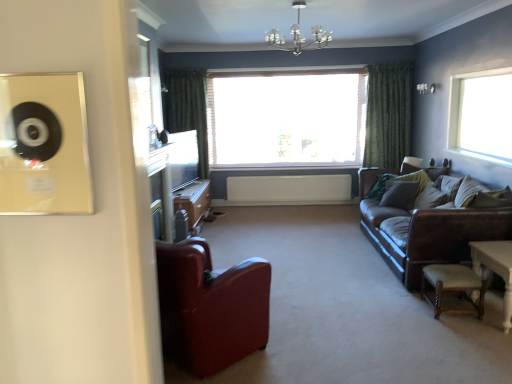
You are a GUI agent. You are given a task and a screenshot of the screen. Output one action in this format:
    pyautogui.click(x=<x>, y=<y>)
    Task: Click on the green velvet curtain at left, acting as the second curtain starting from the right
    
    Given the screenshot: What is the action you would take?
    pyautogui.click(x=187, y=108)

The width and height of the screenshot is (512, 384). Describe the element at coordinates (496, 269) in the screenshot. I see `white wooden table at lower right` at that location.

Measure the distance between point (241,340) and camera.

2.65 meters.

In order to face leather armchair at lower left, should I rotate leftwards or rightwards?

Rotate left and turn 8.170 degrees.

Locate an element on the screen. The image size is (512, 384). brown leather couch at right is located at coordinates click(x=432, y=236).

This screenshot has width=512, height=384. What do you see at coordinates (468, 192) in the screenshot?
I see `brown fabric pillow at right, acting as the second pillow starting from the back` at bounding box center [468, 192].

The height and width of the screenshot is (384, 512). What are the coordinates of `green velvet curtain at left, acting as the second curtain starting from the right` in the screenshot? It's located at (187, 108).

Which object is wider, transparent glass window at upper right, which appears as the first window when viewed from the front, or beige woven stool at lower right?

Wider between the two is beige woven stool at lower right.

Which object is more forward, transparent glass window at upper right, which appears as the first window when viewed from the front, or beige woven stool at lower right?

beige woven stool at lower right is closer to the camera.

Between transparent glass window at upper right, the 2th window positioned from the back, and beige woven stool at lower right, which one has less height?

beige woven stool at lower right.

Are transparent glass window at upper right, the 1th window viewed from the right, and beige woven stool at lower right making contact?

No, transparent glass window at upper right, the 1th window viewed from the right, is not in contact with beige woven stool at lower right.

Which is more to the right, green fabric pillow at center, the 1th pillow when ordered from back to front, or brown leather couch at right?

From the viewer's perspective, brown leather couch at right appears more on the right side.

Does green fabric pillow at center, the 1th pillow when ordered from back to front, contain brown leather couch at right?

No, green fabric pillow at center, the 1th pillow when ordered from back to front, does not contain brown leather couch at right.

Looking at this image, which object is closer to the camera taking this photo, green fabric pillow at center, the 1th pillow when ordered from back to front, or brown leather couch at right?

brown leather couch at right is closer to the camera.

Consider the image. Which object is closer to the camera taking this photo, green textured curtain at center, which ranks as the second curtain in left-to-right order, or transparent glass window at upper right, the 1th window viewed from the right?

Positioned in front is transparent glass window at upper right, the 1th window viewed from the right.

Which object is positioned more to the right, green textured curtain at center, which ranks as the second curtain in left-to-right order, or transparent glass window at upper right, the 1th window viewed from the right?

From the viewer's perspective, transparent glass window at upper right, the 1th window viewed from the right, appears more on the right side.

The height and width of the screenshot is (384, 512). Identify the location of window on the right of the green textured curtain at center, which ranks as the second curtain in left-to-right order. (481, 115).

Between green fabric pillow at center, which is counted as the first pillow, starting from the left, and brown fabric pillow at right, which is the second pillow from left to right, which one has smaller size?

green fabric pillow at center, which is counted as the first pillow, starting from the left, is smaller.

Is green fabric pillow at center, which ranks as the second pillow in front-to-back order, further to the viewer compared to brown fabric pillow at right, arranged as the 1th pillow when viewed from the right?

Yes, green fabric pillow at center, which ranks as the second pillow in front-to-back order, is behind brown fabric pillow at right, arranged as the 1th pillow when viewed from the right.

From the picture: Is brown fabric pillow at right, arranged as the 1th pillow when viewed from the right, completely or partially inside green fabric pillow at center, which is counted as the first pillow, starting from the left?

No, green fabric pillow at center, which is counted as the first pillow, starting from the left, does not contain brown fabric pillow at right, arranged as the 1th pillow when viewed from the right.

Locate an element on the screen. The height and width of the screenshot is (384, 512). radiator that is above the brown fabric pillow at right, arranged as the 1th pillow when viewed from the right (from the image's perspective) is located at coordinates (290, 189).

Who is smaller, brown fabric pillow at right, acting as the second pillow starting from the back, or white plastic radiator at center?

Smaller between the two is brown fabric pillow at right, acting as the second pillow starting from the back.

In the image, is brown fabric pillow at right, which is the second pillow from left to right, on the left side or the right side of white plastic radiator at center?

brown fabric pillow at right, which is the second pillow from left to right, is to the right of white plastic radiator at center.

Looking at the image, does leather armchair at lower left seem bigger or smaller compared to white wooden table at lower right?

In the image, leather armchair at lower left appears to be larger than white wooden table at lower right.

Is leather armchair at lower left placed right next to white wooden table at lower right?

They are not placed beside each other.

How different are the orientations of leather armchair at lower left and white wooden table at lower right in degrees?

leather armchair at lower left and white wooden table at lower right are facing 134 degrees away from each other.

Considering the sizes of leather armchair at lower left and white wooden table at lower right in the image, is leather armchair at lower left wider or thinner than white wooden table at lower right?

Clearly, leather armchair at lower left has more width compared to white wooden table at lower right.

Is green velvet curtain at left, which is counted as the 1th curtain, starting from the left, turned away from brown fabric pillow at right, arranged as the 1th pillow when viewed from the right?

That's not correct — green velvet curtain at left, which is counted as the 1th curtain, starting from the left, is not looking away from brown fabric pillow at right, arranged as the 1th pillow when viewed from the right.

In terms of height, does green velvet curtain at left, which is counted as the 1th curtain, starting from the left, look taller or shorter compared to brown fabric pillow at right, acting as the 1th pillow starting from the front?

Considering their sizes, green velvet curtain at left, which is counted as the 1th curtain, starting from the left, has more height than brown fabric pillow at right, acting as the 1th pillow starting from the front.

Could brown fabric pillow at right, acting as the second pillow starting from the back, be considered to be inside green velvet curtain at left, which is counted as the 1th curtain, starting from the left?

No, brown fabric pillow at right, acting as the second pillow starting from the back, is not inside green velvet curtain at left, which is counted as the 1th curtain, starting from the left.

From the image's perspective, starting from the beige woven stool at lower right, which window is the 1st one above? Please provide its 2D coordinates.

[(481, 115)]

Find the location of `studio couch directly beneath the green fabric pillow at center, which is counted as the first pillow, starting from the left (from a real-world perspective)`. studio couch directly beneath the green fabric pillow at center, which is counted as the first pillow, starting from the left (from a real-world perspective) is located at coordinates (432, 236).

Which object lies nearer to the anchor point green fabric pillow at center, the 2th pillow in the right-to-left sequence, white wooden table at lower right or white plastic radiator at center?

Among the two, white wooden table at lower right is located nearer to green fabric pillow at center, the 2th pillow in the right-to-left sequence.

Looking at the image, which one is located closer to green textured curtain at center, which ranks as the second curtain in left-to-right order, beige woven stool at lower right or green fabric pillow at center, the 2th pillow in the right-to-left sequence?

Based on the image, green fabric pillow at center, the 2th pillow in the right-to-left sequence, appears to be nearer to green textured curtain at center, which ranks as the second curtain in left-to-right order.

Estimate the real-world distances between objects in this image. Which object is further from green velvet curtain at left, which is counted as the 1th curtain, starting from the left, white plastic radiator at center or leather armchair at lower left?

leather armchair at lower left lies further to green velvet curtain at left, which is counted as the 1th curtain, starting from the left, than the other object.

Estimate the real-world distances between objects in this image. Which object is further from white plastic radiator at center, brown fabric pillow at right, acting as the 1th pillow starting from the front, or transparent glass window at upper right, the 2th window positioned from the back?

brown fabric pillow at right, acting as the 1th pillow starting from the front, is further to white plastic radiator at center.

From the image, which object appears to be nearer to white wooden table at lower right, white wooden window at center, acting as the first window starting from the left, or metallic chandelier at upper center?

metallic chandelier at upper center lies closer to white wooden table at lower right than the other object.

From the image, which object appears to be farther from green velvet curtain at left, which is counted as the 1th curtain, starting from the left, brown fabric pillow at right, arranged as the 1th pillow when viewed from the right, or white wooden table at lower right?

The object further to green velvet curtain at left, which is counted as the 1th curtain, starting from the left, is white wooden table at lower right.

From the image, which object appears to be nearer to green fabric pillow at center, the 1th pillow when ordered from back to front, transparent glass window at upper right, the 2th window positioned from the back, or beige woven stool at lower right?

Among the two, transparent glass window at upper right, the 2th window positioned from the back, is located nearer to green fabric pillow at center, the 1th pillow when ordered from back to front.

Based on their spatial positions, is green fabric pillow at center, which is counted as the first pillow, starting from the left, or brown fabric pillow at right, acting as the 1th pillow starting from the front, further from metallic chandelier at upper center?

brown fabric pillow at right, acting as the 1th pillow starting from the front, lies further to metallic chandelier at upper center than the other object.

The height and width of the screenshot is (384, 512). Find the location of `curtain located between metallic chandelier at upper center and green velvet curtain at left, acting as the second curtain starting from the right, in the depth direction`. curtain located between metallic chandelier at upper center and green velvet curtain at left, acting as the second curtain starting from the right, in the depth direction is located at coordinates pyautogui.click(x=388, y=114).

At what (x,y) coordinates should I click in order to perform the action: click on studio couch located between leather armchair at lower left and wooden cabinet at center in the depth direction. Please return your answer as a coordinate pair (x, y). This screenshot has width=512, height=384. Looking at the image, I should click on (432, 236).

At what (x,y) coordinates should I click in order to perform the action: click on studio couch between wooden cabinet at center and brown fabric pillow at right, arranged as the 1th pillow when viewed from the right, from left to right. Please return your answer as a coordinate pair (x, y). The image size is (512, 384). Looking at the image, I should click on (432, 236).

I want to click on light fixture located between beige woven stool at lower right and green textured curtain at center, which ranks as the second curtain in left-to-right order, in the depth direction, so click(x=298, y=35).